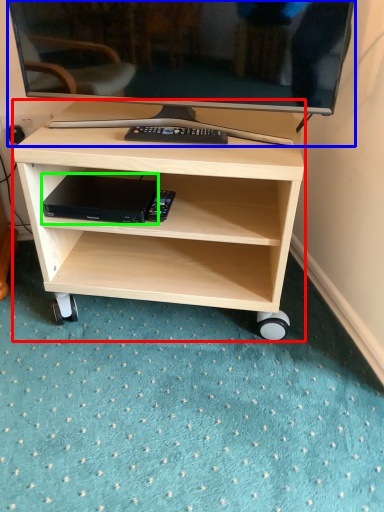
Question: Based on their relative distances, which object is nearer to desk (highlighted by a red box)? Choose from television (highlighted by a blue box) and computer (highlighted by a green box).

Choices:
 (A) television
 (B) computer

Answer: (B)